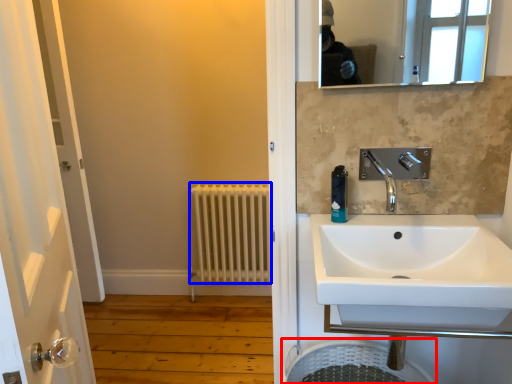
Question: Which object appears closest to the camera in this image, laundry basket (highlighted by a red box) or radiator (highlighted by a blue box)?

Choices:
 (A) laundry basket
 (B) radiator

Answer: (A)